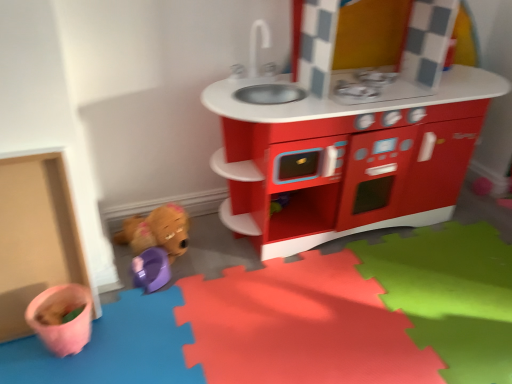
The height and width of the screenshot is (384, 512). What do you see at coordinates (157, 231) in the screenshot?
I see `brown plush toy at lower left, arranged as the second toy when ordered from the bottom` at bounding box center [157, 231].

You are a GUI agent. You are given a task and a screenshot of the screen. Output one action in this format:
    pyautogui.click(x=<x>, y=<y>)
    Task: Click on the purple plastic toy at lower left, which ranks as the first toy in bottom-to-top order
    This screenshot has width=512, height=384.
    Given the screenshot: What is the action you would take?
    pyautogui.click(x=151, y=269)

Where is `brown plush toy at lower left, which is the first toy from top to bottom`? brown plush toy at lower left, which is the first toy from top to bottom is located at coordinates (157, 231).

Considering their positions, is brown plush toy at lower left, which is the first toy from top to bottom, located in front of or behind purple plastic toy at lower left, which ranks as the first toy in bottom-to-top order?

Clearly, brown plush toy at lower left, which is the first toy from top to bottom, is behind purple plastic toy at lower left, which ranks as the first toy in bottom-to-top order.

Consider the image. Is brown plush toy at lower left, which is the first toy from top to bottom, shorter than purple plastic toy at lower left, which ranks as the first toy in bottom-to-top order?

Incorrect, the height of brown plush toy at lower left, which is the first toy from top to bottom, does not fall short of that of purple plastic toy at lower left, which ranks as the first toy in bottom-to-top order.

Is brown plush toy at lower left, arranged as the second toy when ordered from the bottom, oriented towards purple plastic toy at lower left, which ranks as the first toy in bottom-to-top order?

Yes, brown plush toy at lower left, arranged as the second toy when ordered from the bottom, is oriented towards purple plastic toy at lower left, which ranks as the first toy in bottom-to-top order.

Consider the image. From a real-world perspective, is brown plush toy at lower left, arranged as the second toy when ordered from the bottom, above or below purple plastic toy at lower left, which ranks as the first toy in bottom-to-top order?

brown plush toy at lower left, arranged as the second toy when ordered from the bottom, is situated higher than purple plastic toy at lower left, which ranks as the first toy in bottom-to-top order, in the real world.

Considering the positions of objects brown plush toy at lower left, which is the first toy from top to bottom, and matte plastic play kitchen at center in the image provided, who is more to the left, brown plush toy at lower left, which is the first toy from top to bottom, or matte plastic play kitchen at center?

brown plush toy at lower left, which is the first toy from top to bottom, is more to the left.

Is brown plush toy at lower left, arranged as the second toy when ordered from the bottom, turned away from matte plastic play kitchen at center?

No, brown plush toy at lower left, arranged as the second toy when ordered from the bottom,'s orientation is not away from matte plastic play kitchen at center.

This screenshot has height=384, width=512. I want to click on the 1st toy below when counting from the matte plastic play kitchen at center (from the image's perspective), so click(157, 231).

Is point (125, 235) closer or farther from the camera than point (234, 179)?

Point (125, 235) is positioned farther from the camera compared to point (234, 179).

Is matte plastic play kitchen at center placed right next to brown plush toy at lower left, which is the first toy from top to bottom?

No, matte plastic play kitchen at center is not next to brown plush toy at lower left, which is the first toy from top to bottom.

From the image's perspective, which is above, matte plastic play kitchen at center or brown plush toy at lower left, which is the first toy from top to bottom?

matte plastic play kitchen at center appears higher in the image.

Based on the photo, does matte plastic play kitchen at center have a lesser height compared to brown plush toy at lower left, which is the first toy from top to bottom?

In fact, matte plastic play kitchen at center may be taller than brown plush toy at lower left, which is the first toy from top to bottom.

Considering the sizes of matte plastic play kitchen at center and brown plush toy at lower left, which is the first toy from top to bottom, in the image, is matte plastic play kitchen at center bigger or smaller than brown plush toy at lower left, which is the first toy from top to bottom,?

Considering their sizes, matte plastic play kitchen at center takes up more space than brown plush toy at lower left, which is the first toy from top to bottom.

From a real-world perspective, who is located lower, purple plastic toy at lower left, which ranks as the first toy in bottom-to-top order, or matte plastic play kitchen at center?

From a 3D spatial view, purple plastic toy at lower left, which ranks as the first toy in bottom-to-top order, is below.

From the image's perspective, is purple plastic toy at lower left, which ranks as the first toy in bottom-to-top order, on matte plastic play kitchen at center?

Actually, purple plastic toy at lower left, which ranks as the first toy in bottom-to-top order, appears below matte plastic play kitchen at center in the image.

Considering the sizes of objects purple plastic toy at lower left, which is counted as the second toy, starting from the top, and matte plastic play kitchen at center in the image provided, who is wider, purple plastic toy at lower left, which is counted as the second toy, starting from the top, or matte plastic play kitchen at center?

matte plastic play kitchen at center is wider.

Between purple plastic toy at lower left, which is counted as the second toy, starting from the top, and matte plastic play kitchen at center, which one has less height?

purple plastic toy at lower left, which is counted as the second toy, starting from the top, is shorter.

Is purple plastic toy at lower left, which is counted as the second toy, starting from the top, situated inside brown plush toy at lower left, which is the first toy from top to bottom, or outside?

purple plastic toy at lower left, which is counted as the second toy, starting from the top, exists entirely within brown plush toy at lower left, which is the first toy from top to bottom.

Which is more to the right, purple plastic toy at lower left, which ranks as the first toy in bottom-to-top order, or brown plush toy at lower left, which is the first toy from top to bottom?

brown plush toy at lower left, which is the first toy from top to bottom.

From the image's perspective, between purple plastic toy at lower left, which is counted as the second toy, starting from the top, and brown plush toy at lower left, arranged as the second toy when ordered from the bottom, which one is located above?

brown plush toy at lower left, arranged as the second toy when ordered from the bottom, appears higher in the image.

From a real-world perspective, is matte plastic play kitchen at center physically above purple plastic toy at lower left, which ranks as the first toy in bottom-to-top order?

Indeed, from a real-world perspective, matte plastic play kitchen at center stands above purple plastic toy at lower left, which ranks as the first toy in bottom-to-top order.

Locate an element on the screen. The height and width of the screenshot is (384, 512). cabinetry on the right of purple plastic toy at lower left, which ranks as the first toy in bottom-to-top order is located at coordinates (345, 173).

From the image's perspective, which one is positioned higher, matte plastic play kitchen at center or purple plastic toy at lower left, which ranks as the first toy in bottom-to-top order?

matte plastic play kitchen at center appears higher in the image.

Where is `toy above the purple plastic toy at lower left, which is counted as the second toy, starting from the top (from a real-world perspective)`? toy above the purple plastic toy at lower left, which is counted as the second toy, starting from the top (from a real-world perspective) is located at coordinates (157, 231).

The height and width of the screenshot is (384, 512). What are the coordinates of `cabinetry on the right of brown plush toy at lower left, arranged as the second toy when ordered from the bottom` in the screenshot? It's located at (345, 173).

Looking at this image, looking at the image, which one is located further to purple plastic toy at lower left, which is counted as the second toy, starting from the top, brown plush toy at lower left, arranged as the second toy when ordered from the bottom, or matte plastic play kitchen at center?

matte plastic play kitchen at center is further to purple plastic toy at lower left, which is counted as the second toy, starting from the top.

When comparing their distances from brown plush toy at lower left, arranged as the second toy when ordered from the bottom, does purple plastic toy at lower left, which is counted as the second toy, starting from the top, or matte plastic play kitchen at center seem further?

matte plastic play kitchen at center.

Estimate the real-world distances between objects in this image. Which object is closer to purple plastic toy at lower left, which is counted as the second toy, starting from the top, matte plastic play kitchen at center or brown plush toy at lower left, arranged as the second toy when ordered from the bottom?

brown plush toy at lower left, arranged as the second toy when ordered from the bottom, lies closer to purple plastic toy at lower left, which is counted as the second toy, starting from the top, than the other object.

Based on their spatial positions, is matte plastic play kitchen at center or purple plastic toy at lower left, which ranks as the first toy in bottom-to-top order, closer to brown plush toy at lower left, which is the first toy from top to bottom?

purple plastic toy at lower left, which ranks as the first toy in bottom-to-top order, lies closer to brown plush toy at lower left, which is the first toy from top to bottom, than the other object.

Based on their spatial positions, is brown plush toy at lower left, which is the first toy from top to bottom, or purple plastic toy at lower left, which ranks as the first toy in bottom-to-top order, closer to matte plastic play kitchen at center?

Among the two, brown plush toy at lower left, which is the first toy from top to bottom, is located nearer to matte plastic play kitchen at center.

Looking at the image, which one is located further to matte plastic play kitchen at center, purple plastic toy at lower left, which is counted as the second toy, starting from the top, or brown plush toy at lower left, arranged as the second toy when ordered from the bottom?

Among the two, purple plastic toy at lower left, which is counted as the second toy, starting from the top, is located further to matte plastic play kitchen at center.

Locate an element on the screen. toy between purple plastic toy at lower left, which is counted as the second toy, starting from the top, and matte plastic play kitchen at center, in the horizontal direction is located at coordinates (157, 231).